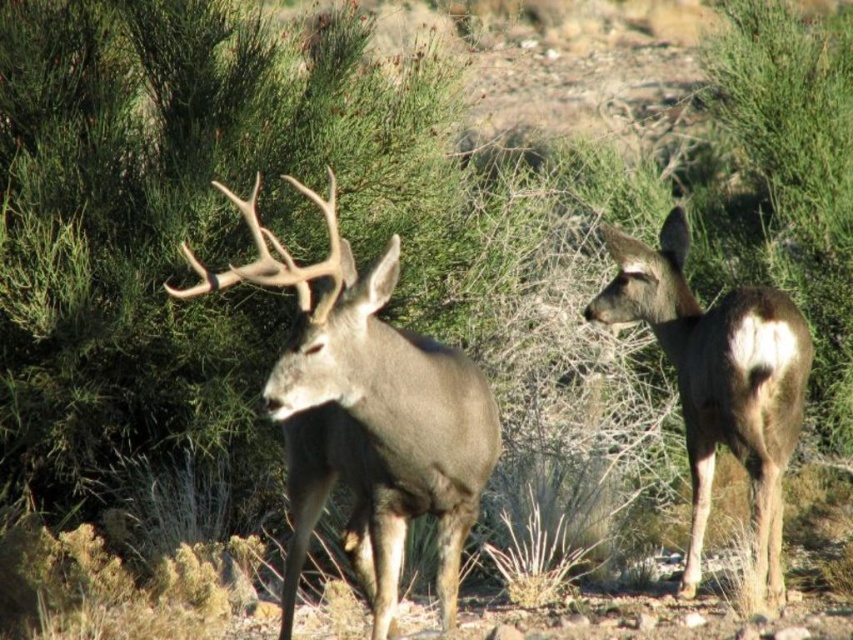
Question: Which point is farther to the camera?

Choices:
 (A) brown fur deer at right
 (B) brown velvet deer at center

Answer: (A)

Question: Can you confirm if brown velvet deer at center is bigger than brown fur deer at right?

Choices:
 (A) yes
 (B) no

Answer: (A)

Question: Which point is closer to the camera taking this photo?

Choices:
 (A) (402, 452)
 (B) (706, 426)

Answer: (A)

Question: Among these points, which one is nearest to the camera?

Choices:
 (A) (767, 481)
 (B) (329, 476)

Answer: (B)

Question: Is brown velvet deer at center behind brown fur deer at right?

Choices:
 (A) no
 (B) yes

Answer: (A)

Question: Is brown velvet deer at center positioned before brown fur deer at right?

Choices:
 (A) no
 (B) yes

Answer: (B)